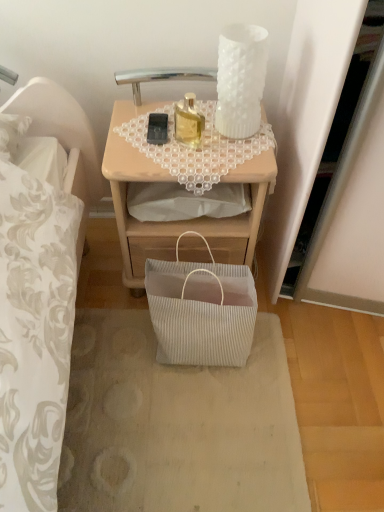
At what (x,y) coordinates should I click in order to perform the action: click on free space in front of white pleated bag at lower center. Please return your answer as a coordinate pair (x, y). The height and width of the screenshot is (512, 384). Looking at the image, I should click on (191, 435).